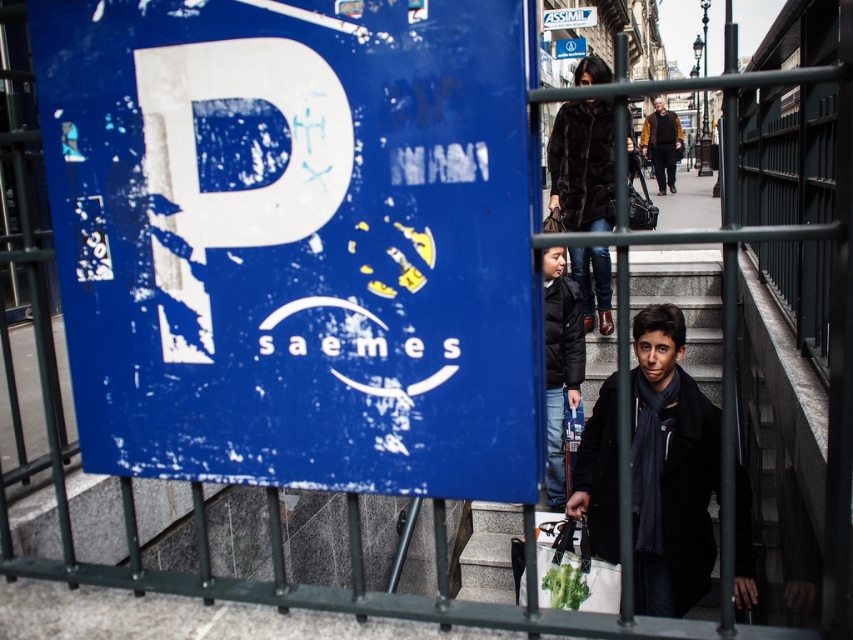
Is point (207, 312) behind point (579, 54)?

No, (207, 312) is closer to viewer.

From the picture: Who is taller, blue matte sign at left or blue matte sign at upper center?

With more height is blue matte sign at left.

Measure the distance between point (323, 388) and camera.

Point (323, 388) is 5.14 feet from camera.

The height and width of the screenshot is (640, 853). I want to click on blue matte sign at left, so click(x=296, y=241).

Who is more forward, [403,172] or [547,19]?

Point [403,172] is more forward.

Looking at this image, who is positioned more to the right, blue matte sign at left or white plastic sign at upper center?

white plastic sign at upper center is more to the right.

Is point (126, 422) less distant than point (582, 8)?

Yes, point (126, 422) is closer to viewer.

This screenshot has height=640, width=853. Find the location of `blue matte sign at left`. blue matte sign at left is located at coordinates (296, 241).

Is black fur coat at center behind green fabric bag at lower center?

Yes, black fur coat at center is behind green fabric bag at lower center.

Does black fur coat at center have a larger size compared to green fabric bag at lower center?

Correct, black fur coat at center is larger in size than green fabric bag at lower center.

What do you see at coordinates (582, 164) in the screenshot? This screenshot has height=640, width=853. I see `black fur coat at center` at bounding box center [582, 164].

Image resolution: width=853 pixels, height=640 pixels. What are the coordinates of `black fur coat at center` in the screenshot? It's located at (582, 164).